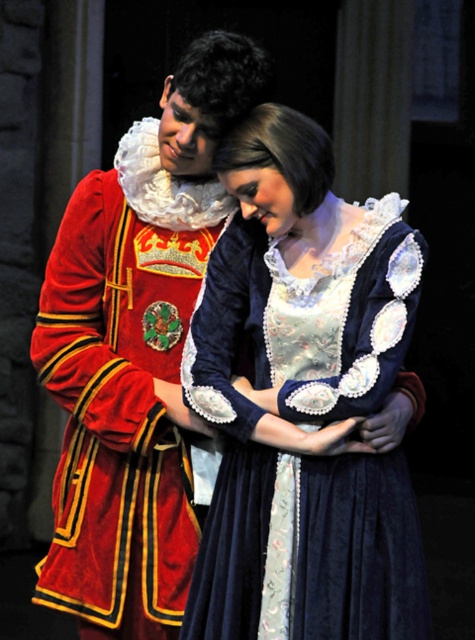
Looking at this image, you are a costume designer examining the image. You need to determine the layering of the costumes. Which costume is positioned closer to the viewer, the velvet dress at center or the velvet red coat at center?

The velvet dress at center is positioned closer to the viewer than the velvet red coat at center.